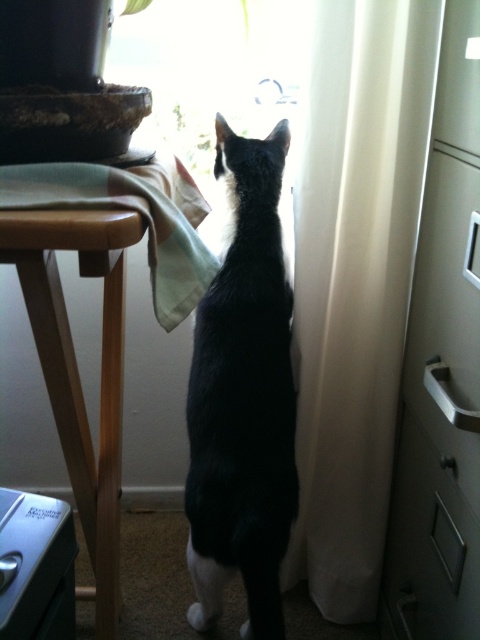
You are organizing a small party and need to place a 1.5 square foot cake on a surface. Given the wooden table at left and the metallic silver file cabinet at lower left, which surface can accommodate the cake without it overhanging?

The wooden table at left can accommodate the cake without it overhanging because it is bigger than the metallic silver file cabinet at lower left.

You are planning to replace the white sheer curtain at right and the light green cotton cloth at left with new ones. Which one requires a larger piece of fabric to cover the existing area?

The white sheer curtain at right requires a larger piece of fabric since it is larger in size than the light green cotton cloth at left.

You are organizing a space and need to place a new plant pot between the wooden table at left and the metallic silver file cabinet at lower left. Based on their positions, which object should the pot be closer to?

The wooden table at left is to the right of the metallic silver file cabinet at lower left, so the pot should be placed closer to the metallic silver file cabinet at lower left to maintain alignment with their positions.